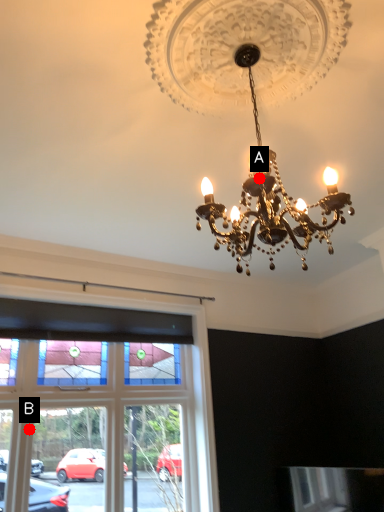
Question: Two points are circled on the image, labeled by A and B beside each circle. Which point is further to the camera?

Choices:
 (A) A is further
 (B) B is further

Answer: (B)